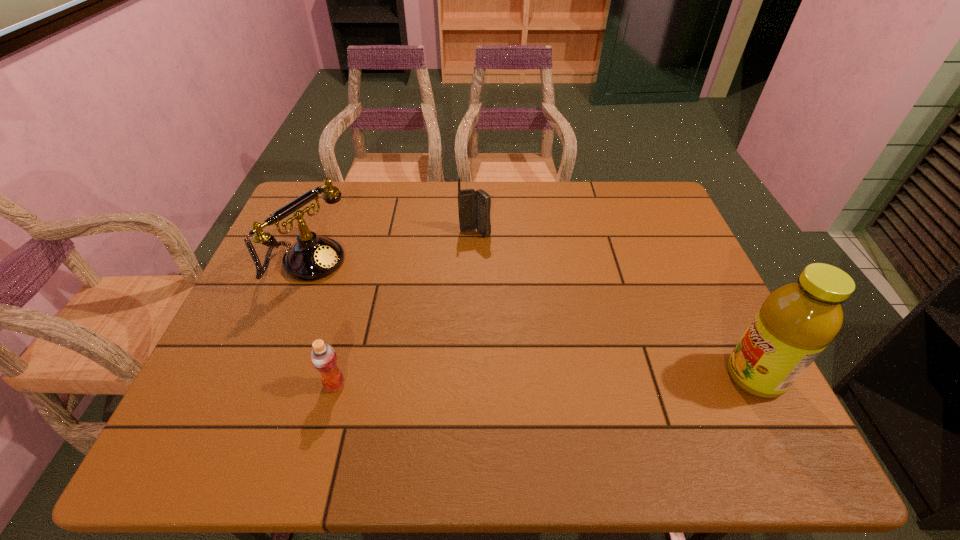
Where is `empty space that is in between the cellular telephone and the leftmost object`? empty space that is in between the cellular telephone and the leftmost object is located at coordinates (391, 248).

The width and height of the screenshot is (960, 540). Identify the location of unoccupied position between the orange juice and the telephone. (321, 323).

This screenshot has height=540, width=960. I want to click on free space between the leftmost object and the orange juice, so click(321, 323).

Identify the location of unoccupied area between the leftmost object and the fruit juice. (531, 320).

Where is `vacant space in between the third object from right to left and the telephone`? vacant space in between the third object from right to left and the telephone is located at coordinates (321, 323).

Identify the location of free space between the tallest object and the leftmost object. The width and height of the screenshot is (960, 540). (531, 320).

Select which object appears as the closest to the cellular telephone. Please provide its 2D coordinates. Your answer should be formatted as a tuple, i.e. [(x, y)], where the tuple contains the x and y coordinates of a point satisfying the conditions above.

[(312, 257)]

Identify the location of object that can be found as the closest to the fruit juice. This screenshot has width=960, height=540. (474, 207).

Locate an element on the screen. This screenshot has height=540, width=960. blank area in the image that satisfies the following two spatial constraints: 1. on the front side of the leftmost object; 2. on the front label of the fruit juice is located at coordinates (261, 376).

Identify the location of free space in the image that satisfies the following two spatial constraints: 1. on the front side of the cellular telephone; 2. on the front label of the tallest object. This screenshot has height=540, width=960. (473, 376).